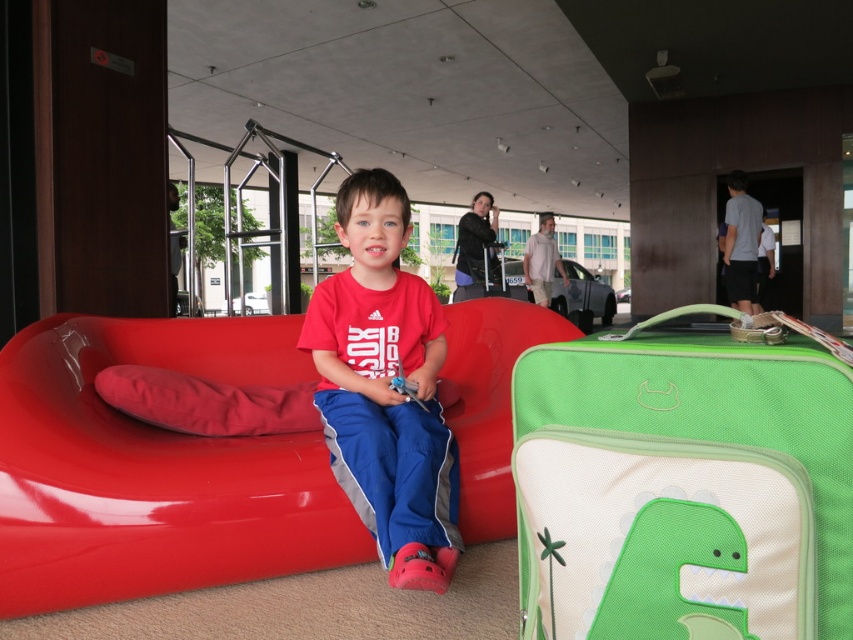
You are standing at the entrance of the building and want to sit down on the matte plastic couch at center. Which direction should you walk to reach it?

The matte plastic couch at center is located at point (154,468), so you should walk towards the center of the image to reach it.

You are a traveler who just arrived at the airport. You need to place your green fabric suitcase at center on top of the matte plastic couch at center. Can you do this without the suitcase touching the floor?

The green fabric suitcase at center has a lesser height compared to matte plastic couch at center, so placing it on top would mean the suitcase is elevated above the floor, so yes, it can be placed without touching the floor.